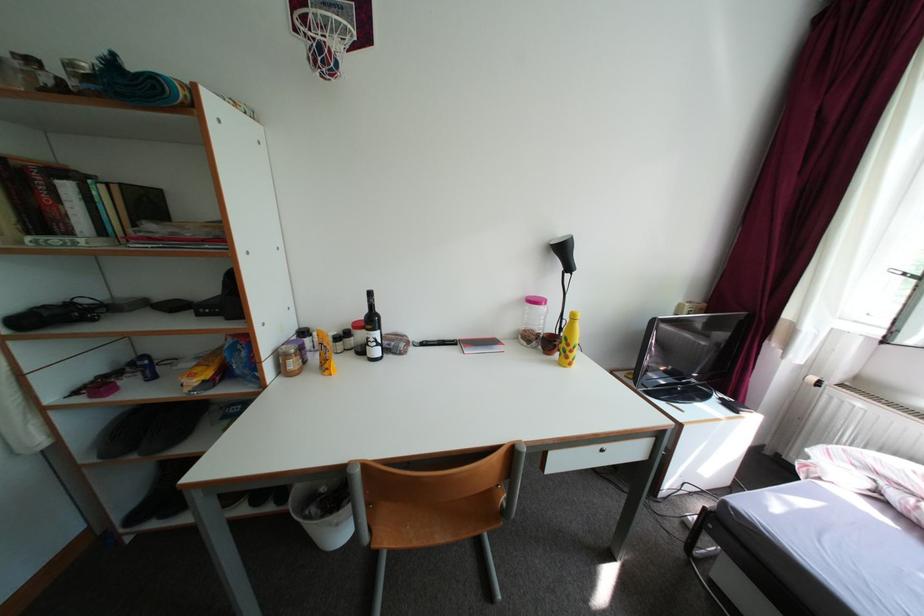
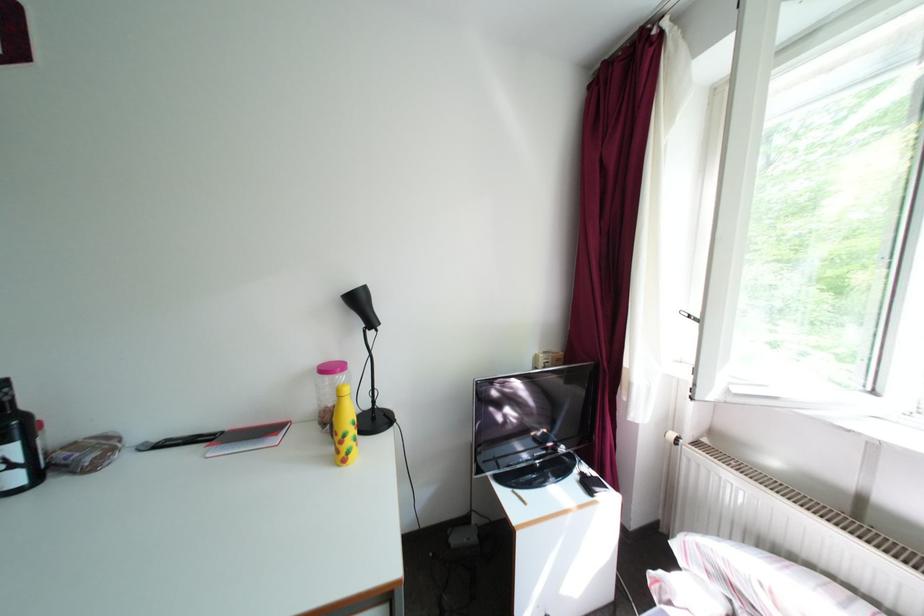
Question: In a continuous first-person perspective shot, in which direction is the camera moving?

Choices:
 (A) Left
 (B) Right
 (C) Forward
 (D) Backward

Answer: (B)